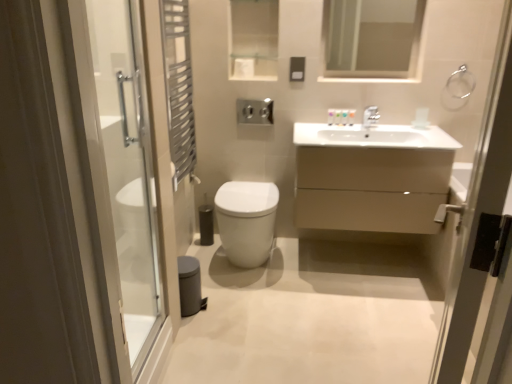
Question: Considering the relative positions of metallic silver towel ring at right, the first screen door positioned from the right, and clear glass mirror at upper center in the image provided, is metallic silver towel ring at right, the first screen door positioned from the right, to the left or to the right of clear glass mirror at upper center?

Choices:
 (A) left
 (B) right

Answer: (A)

Question: From a real-world perspective, relative to clear glass mirror at upper center, is metallic silver towel ring at right, the first screen door positioned from the right, vertically above or below?

Choices:
 (A) above
 (B) below

Answer: (B)

Question: Considering the real-world distances, which object is closest to the silver metallic towel ring at upper right?

Choices:
 (A) metallic silver towel ring at right, the first screen door positioned from the right
 (B) transparent glass shower door at left, which is the second screen door in right-to-left order
 (C) clear glass mirror at upper center
 (D) white glossy toilet at center
 (E) matte beige cabinet at center

Answer: (C)

Question: Which object is positioned farthest from the metallic silver towel rack at left?

Choices:
 (A) satin nickel faucet at upper center
 (B) clear glass mirror at upper center
 (C) transparent glass shower door at left, the first screen door from the left
 (D) silver metallic towel ring at upper right
 (E) metallic silver towel ring at right, the first screen door positioned from the right

Answer: (E)